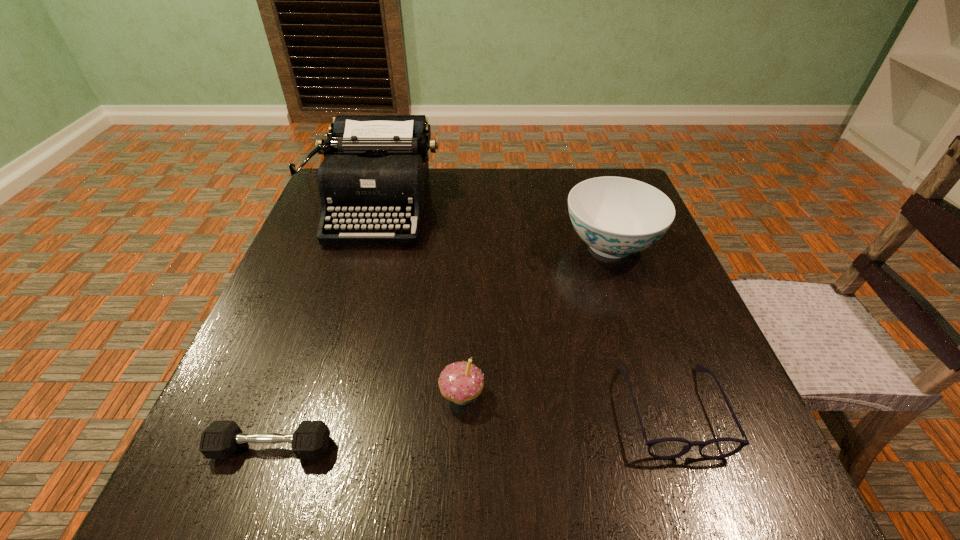
The height and width of the screenshot is (540, 960). I want to click on chinaware at the far edge, so click(616, 216).

Locate an element on the screen. Image resolution: width=960 pixels, height=540 pixels. spectacles that is at the near edge is located at coordinates (664, 448).

At what (x,y) coordinates should I click in order to perform the action: click on dumbbell situated at the near edge. Please return your answer as a coordinate pair (x, y). Looking at the image, I should click on (220, 439).

The image size is (960, 540). Identify the location of typewriter that is at the left edge. click(x=375, y=170).

What are the coordinates of `dumbbell positioned at the left edge` in the screenshot? It's located at (220, 439).

Find the location of a particular element. Image resolution: width=960 pixels, height=540 pixels. chinaware at the right edge is located at coordinates (616, 216).

Identify the location of spectacles present at the right edge. (664, 448).

Find the location of a particular element. The width and height of the screenshot is (960, 540). object at the far left corner is located at coordinates (375, 170).

This screenshot has width=960, height=540. Find the location of `object that is at the near left corner`. object that is at the near left corner is located at coordinates (220, 439).

You are a GUI agent. You are given a task and a screenshot of the screen. Output one action in this format:
    pyautogui.click(x=<x>, y=<y>)
    Task: Click on the object that is at the far right corner
    This screenshot has height=540, width=960.
    Given the screenshot: What is the action you would take?
    pyautogui.click(x=616, y=216)